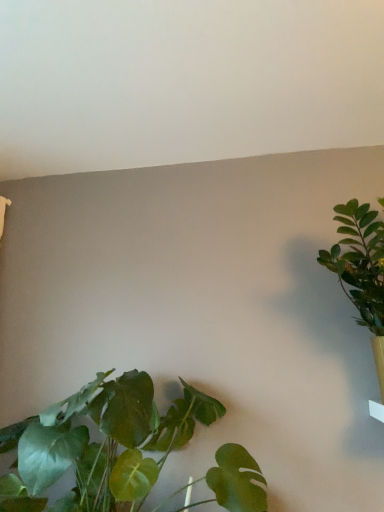
Find the location of a particular element. The height and width of the screenshot is (512, 384). green leafy plant at right, arranged as the 2th houseplant when viewed from the left is located at coordinates (361, 270).

Describe the element at coordinates (361, 270) in the screenshot. I see `green leafy plant at right, positioned as the first houseplant in right-to-left order` at that location.

From the picture: In order to face green leafy plant at right, positioned as the first houseplant in right-to-left order, should I rotate leftwards or rightwards?

Turn right approximately 22.405 degrees to face it.

The height and width of the screenshot is (512, 384). What do you see at coordinates (100, 445) in the screenshot? I see `green leafy plant at lower left, which is counted as the 2th houseplant, starting from the right` at bounding box center [100, 445].

At what (x,y) coordinates should I click in order to perform the action: click on green leafy plant at lower left, marked as the first houseplant in a left-to-right arrangement. Please return your answer as a coordinate pair (x, y). The height and width of the screenshot is (512, 384). Looking at the image, I should click on (100, 445).

What are the coordinates of `green leafy plant at right, arranged as the 2th houseplant when viewed from the left` in the screenshot? It's located at (361, 270).

Which is more to the right, green leafy plant at lower left, marked as the first houseplant in a left-to-right arrangement, or green leafy plant at right, arranged as the 2th houseplant when viewed from the left?

green leafy plant at right, arranged as the 2th houseplant when viewed from the left, is more to the right.

Is the position of green leafy plant at lower left, which is counted as the 2th houseplant, starting from the right, more distant than that of green leafy plant at right, arranged as the 2th houseplant when viewed from the left?

That is False.

Which is behind, point (65, 456) or point (382, 343)?

The point (382, 343) is farther from the camera.

From the image's perspective, is green leafy plant at lower left, marked as the first houseplant in a left-to-right arrangement, on green leafy plant at right, positioned as the first houseplant in right-to-left order?

No, from the image's perspective, green leafy plant at lower left, marked as the first houseplant in a left-to-right arrangement, is not on top of green leafy plant at right, positioned as the first houseplant in right-to-left order.

From a real-world perspective, which object stands above the other?

green leafy plant at right, arranged as the 2th houseplant when viewed from the left, from a real-world perspective.

Between green leafy plant at lower left, marked as the first houseplant in a left-to-right arrangement, and green leafy plant at right, arranged as the 2th houseplant when viewed from the left, which one has smaller width?

With smaller width is green leafy plant at lower left, marked as the first houseplant in a left-to-right arrangement.

Can you confirm if green leafy plant at lower left, which is counted as the 2th houseplant, starting from the right, is taller than green leafy plant at right, arranged as the 2th houseplant when viewed from the left?

No, green leafy plant at lower left, which is counted as the 2th houseplant, starting from the right, is not taller than green leafy plant at right, arranged as the 2th houseplant when viewed from the left.

Is green leafy plant at lower left, marked as the first houseplant in a left-to-right arrangement, bigger than green leafy plant at right, positioned as the first houseplant in right-to-left order?

Correct, green leafy plant at lower left, marked as the first houseplant in a left-to-right arrangement, is larger in size than green leafy plant at right, positioned as the first houseplant in right-to-left order.

Is green leafy plant at right, arranged as the 2th houseplant when viewed from the left, inside green leafy plant at lower left, marked as the first houseplant in a left-to-right arrangement?

No, green leafy plant at right, arranged as the 2th houseplant when viewed from the left, is not inside green leafy plant at lower left, marked as the first houseplant in a left-to-right arrangement.

In the scene shown: Is green leafy plant at lower left, marked as the first houseplant in a left-to-right arrangement, touching green leafy plant at right, positioned as the first houseplant in right-to-left order?

green leafy plant at lower left, marked as the first houseplant in a left-to-right arrangement, and green leafy plant at right, positioned as the first houseplant in right-to-left order, are not in contact.

Could you tell me if green leafy plant at lower left, which is counted as the 2th houseplant, starting from the right, is turned towards green leafy plant at right, positioned as the first houseplant in right-to-left order?

No, green leafy plant at lower left, which is counted as the 2th houseplant, starting from the right, does not turn towards green leafy plant at right, positioned as the first houseplant in right-to-left order.

What's the angular difference between green leafy plant at lower left, marked as the first houseplant in a left-to-right arrangement, and green leafy plant at right, positioned as the first houseplant in right-to-left order,'s facing directions?

green leafy plant at lower left, marked as the first houseplant in a left-to-right arrangement, and green leafy plant at right, positioned as the first houseplant in right-to-left order, are facing 0.000676 degrees away from each other.

The height and width of the screenshot is (512, 384). I want to click on houseplant on the left of green leafy plant at right, positioned as the first houseplant in right-to-left order, so click(100, 445).

Which object is positioned more to the right, green leafy plant at right, arranged as the 2th houseplant when viewed from the left, or green leafy plant at lower left, which is counted as the 2th houseplant, starting from the right?

Positioned to the right is green leafy plant at right, arranged as the 2th houseplant when viewed from the left.

Which object is more forward, green leafy plant at right, arranged as the 2th houseplant when viewed from the left, or green leafy plant at lower left, which is counted as the 2th houseplant, starting from the right?

green leafy plant at lower left, which is counted as the 2th houseplant, starting from the right.

Does point (373, 262) come farther from viewer compared to point (214, 406)?

No, (373, 262) is closer to viewer.

In the scene shown: From the image's perspective, which one is positioned higher, green leafy plant at right, positioned as the first houseplant in right-to-left order, or green leafy plant at lower left, which is counted as the 2th houseplant, starting from the right?

green leafy plant at right, positioned as the first houseplant in right-to-left order.

From the picture: From a real-world perspective, between green leafy plant at right, arranged as the 2th houseplant when viewed from the left, and green leafy plant at lower left, which is counted as the 2th houseplant, starting from the right, who is vertically higher?

green leafy plant at right, arranged as the 2th houseplant when viewed from the left, from a real-world perspective.

Between green leafy plant at right, positioned as the first houseplant in right-to-left order, and green leafy plant at lower left, marked as the first houseplant in a left-to-right arrangement, which one has larger width?

With larger width is green leafy plant at right, positioned as the first houseplant in right-to-left order.

Between green leafy plant at right, positioned as the first houseplant in right-to-left order, and green leafy plant at lower left, which is counted as the 2th houseplant, starting from the right, which one has more height?

With more height is green leafy plant at right, positioned as the first houseplant in right-to-left order.

Can you confirm if green leafy plant at right, positioned as the first houseplant in right-to-left order, is bigger than green leafy plant at lower left, marked as the first houseplant in a left-to-right arrangement?

No.

Is green leafy plant at right, arranged as the 2th houseplant when viewed from the left, inside or outside of green leafy plant at lower left, which is counted as the 2th houseplant, starting from the right?

green leafy plant at right, arranged as the 2th houseplant when viewed from the left, cannot be found inside green leafy plant at lower left, which is counted as the 2th houseplant, starting from the right.

In the scene shown: Is green leafy plant at right, arranged as the 2th houseplant when viewed from the left, not near green leafy plant at lower left, which is counted as the 2th houseplant, starting from the right?

No.

Could you tell me if green leafy plant at right, arranged as the 2th houseplant when viewed from the left, is turned towards green leafy plant at lower left, marked as the first houseplant in a left-to-right arrangement?

No, green leafy plant at right, arranged as the 2th houseplant when viewed from the left, is not oriented towards green leafy plant at lower left, marked as the first houseplant in a left-to-right arrangement.

Locate an element on the screen. This screenshot has width=384, height=512. houseplant in front of the green leafy plant at right, arranged as the 2th houseplant when viewed from the left is located at coordinates (100, 445).

Where is `houseplant on the left of green leafy plant at right, arranged as the 2th houseplant when viewed from the left`? houseplant on the left of green leafy plant at right, arranged as the 2th houseplant when viewed from the left is located at coordinates (100, 445).

The height and width of the screenshot is (512, 384). Find the location of `houseplant below the green leafy plant at right, arranged as the 2th houseplant when viewed from the left (from the image's perspective)`. houseplant below the green leafy plant at right, arranged as the 2th houseplant when viewed from the left (from the image's perspective) is located at coordinates (100, 445).